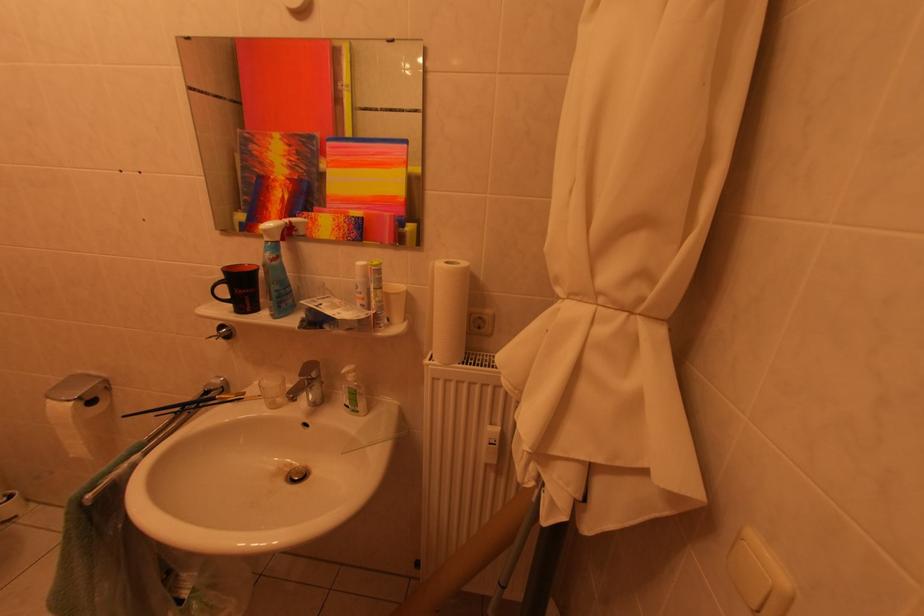
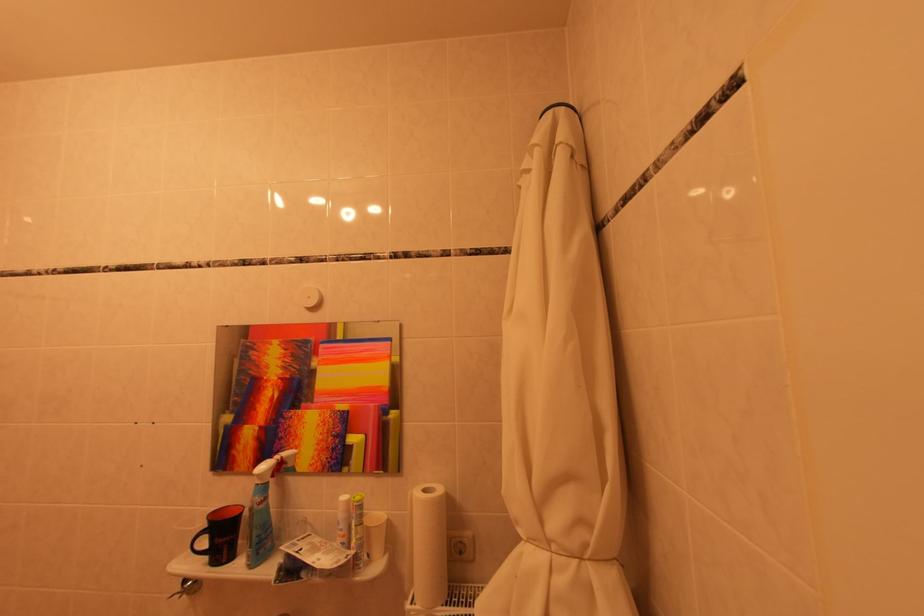
The point at (384,306) is marked in the first image. Where is the corresponding point in the second image?

(365, 544)